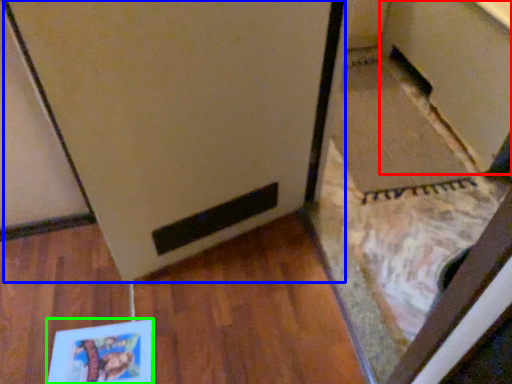
Question: Which object is the farthest from cabinetry (highlighted by a red box)? Choose among these: fridge (highlighted by a blue box) or book (highlighted by a green box).

Choices:
 (A) fridge
 (B) book

Answer: (B)